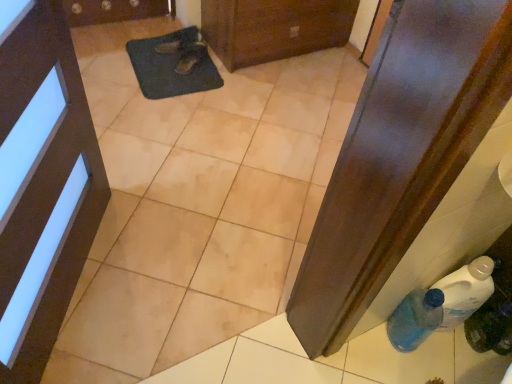
Image resolution: width=512 pixels, height=384 pixels. Find the location of `vacant space that is to the left of black leather shoe at upper center, which is counted as the first footwear, starting from the top`. vacant space that is to the left of black leather shoe at upper center, which is counted as the first footwear, starting from the top is located at coordinates (146, 46).